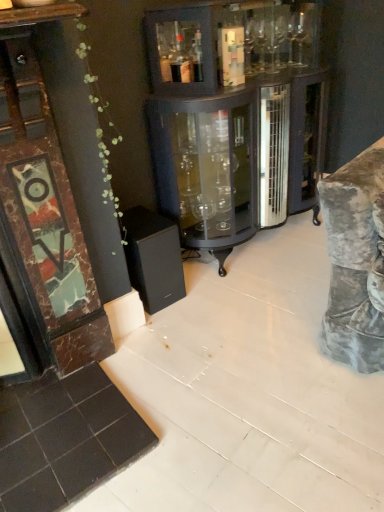
Locate an element on the screen. The image size is (384, 512). vacant point to the right of black matte speaker at lower left is located at coordinates (202, 285).